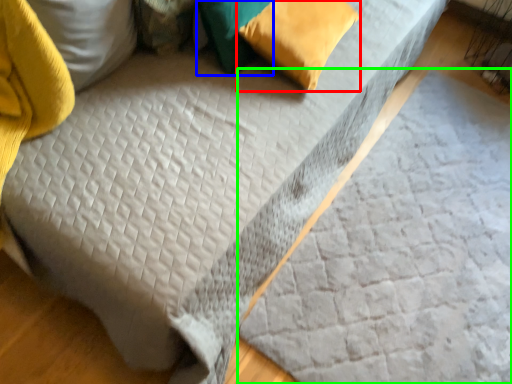
Question: Considering the real-world distances, which object is farthest from pillow (highlighted by a red box)? pillow (highlighted by a blue box) or sheet (highlighted by a green box)?

Choices:
 (A) pillow
 (B) sheet

Answer: (B)